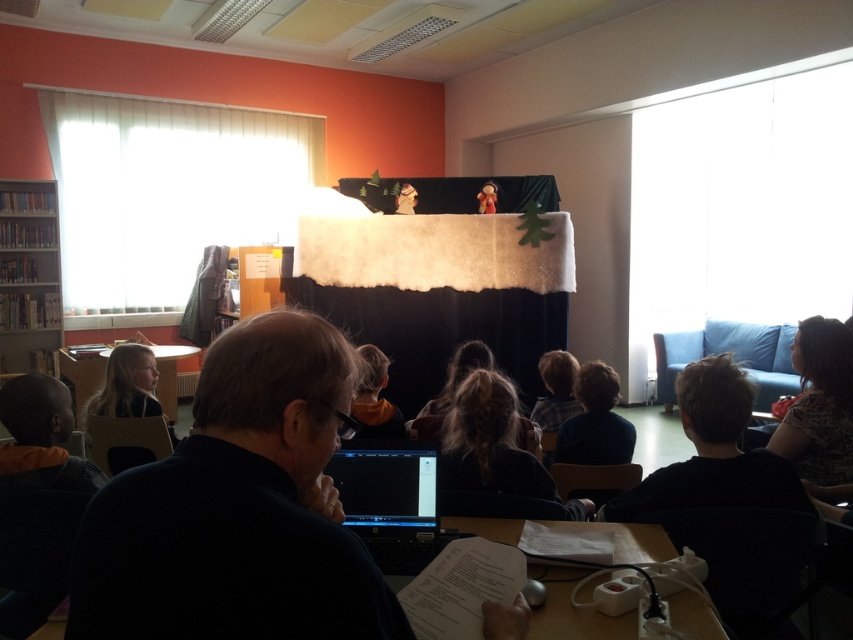
You are organizing a classroom activity and need to place a large poster between the black matte laptop at lower center and the wooden table at center. Given their sizes, which object should the poster be placed closer to?

The black matte laptop at lower center has a smaller width than the wooden table at center, so the poster should be placed closer to the wooden table at center to accommodate its larger size.

You are a student who needs to retrieve a book from the wooden bookshelf at left without disturbing the puppet show. The black matte laptop at lower center is in your path. Can you walk around it to reach the bookshelf?

The black matte laptop at lower center and wooden bookshelf at left are 5.00 meters apart from each other, so yes, you can walk around the black matte laptop at lower center to reach the wooden bookshelf at left since there is enough space between them.